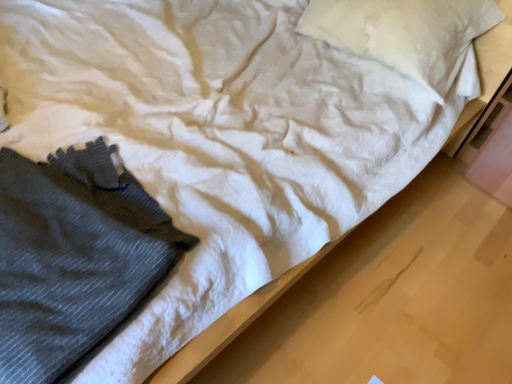
Question: In terms of size, does dark gray knitted sweater at lower left appear bigger or smaller than white cotton pillow at upper center?

Choices:
 (A) big
 (B) small

Answer: (B)

Question: Visually, is dark gray knitted sweater at lower left positioned to the left or to the right of white cotton pillow at upper center?

Choices:
 (A) left
 (B) right

Answer: (A)

Question: From a real-world perspective, relative to white cotton pillow at upper center, is dark gray knitted sweater at lower left vertically above or below?

Choices:
 (A) above
 (B) below

Answer: (B)

Question: Does point (430, 61) appear closer or farther from the camera than point (104, 307)?

Choices:
 (A) closer
 (B) farther

Answer: (B)

Question: From the image's perspective, is white cotton pillow at upper center above or below dark gray knitted sweater at lower left?

Choices:
 (A) below
 (B) above

Answer: (B)

Question: From a real-world perspective, relative to dark gray knitted sweater at lower left, is white cotton pillow at upper center vertically above or below?

Choices:
 (A) below
 (B) above

Answer: (B)

Question: Is white cotton pillow at upper center taller or shorter than dark gray knitted sweater at lower left?

Choices:
 (A) tall
 (B) short

Answer: (A)